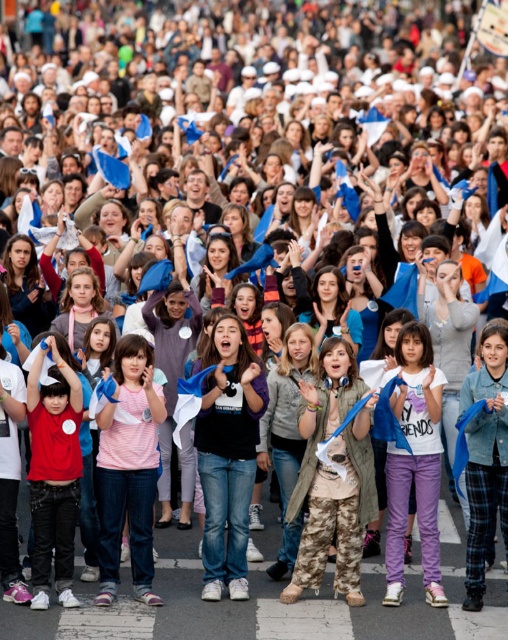
Can you confirm if pink fabric shirt at center is positioned below matte red shirt at left?

No.

Describe the element at coordinates (129, 468) in the screenshot. The width and height of the screenshot is (508, 640). I see `pink fabric shirt at center` at that location.

The width and height of the screenshot is (508, 640). Find the location of `pink fabric shirt at center`. pink fabric shirt at center is located at coordinates (129, 468).

Is camouflage pants at center bigger than matte red shirt at left?

Incorrect, camouflage pants at center is not larger than matte red shirt at left.

Which is in front, point (351, 595) or point (47, 540)?

Point (47, 540)

Find the location of a particular element. This screenshot has width=508, height=640. camouflage pants at center is located at coordinates (333, 476).

Between camouflage pants at center and pink fabric shirt at center, which one has less height?

Standing shorter between the two is camouflage pants at center.

How distant is camouflage pants at center from pink fabric shirt at center?

A distance of 22.00 feet exists between camouflage pants at center and pink fabric shirt at center.

Between point (344, 467) and point (123, 477), which one is positioned in front?

Positioned in front is point (123, 477).

You are a GUI agent. You are given a task and a screenshot of the screen. Output one action in this format:
    pyautogui.click(x=<x>, y=<y>)
    Task: Click on the camouflage pants at center
    The height and width of the screenshot is (640, 508).
    Given the screenshot: What is the action you would take?
    pyautogui.click(x=333, y=476)